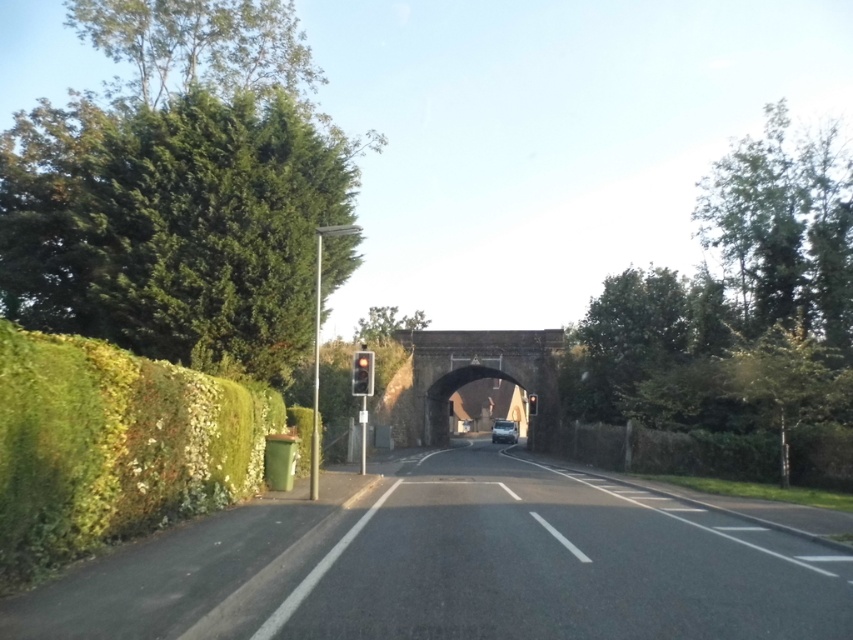
Question: Which object is farther from the camera taking this photo?

Choices:
 (A) green leafy hedge at left
 (B) asphalt road at center

Answer: (A)

Question: Based on their relative distances, which object is nearer to the green leafy tree at right?

Choices:
 (A) metallic silver van at center
 (B) green leafy tree at center
 (C) green leafy hedge at left
 (D) green leafy tree at left

Answer: (D)

Question: Is the position of green leafy tree at center more distant than that of metallic silver van at center?

Choices:
 (A) no
 (B) yes

Answer: (A)

Question: Is asphalt road at center to the right of metallic silver van at center from the viewer's perspective?

Choices:
 (A) no
 (B) yes

Answer: (A)

Question: Is green leafy hedge at left behind metallic silver van at center?

Choices:
 (A) yes
 (B) no

Answer: (B)

Question: Which of the following is the farthest from the observer?

Choices:
 (A) green leafy tree at right
 (B) green leafy tree at center
 (C) asphalt road at center
 (D) metallic silver van at center

Answer: (D)